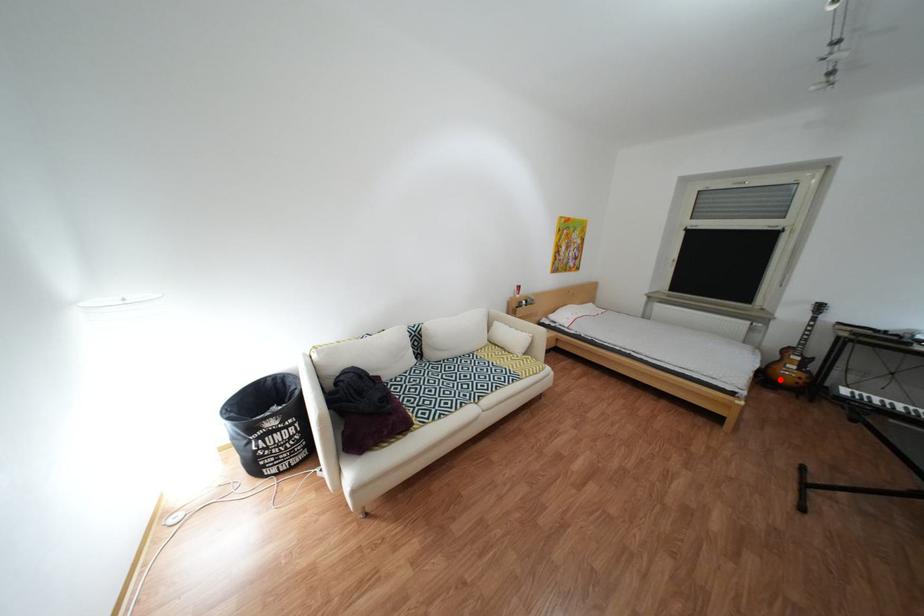
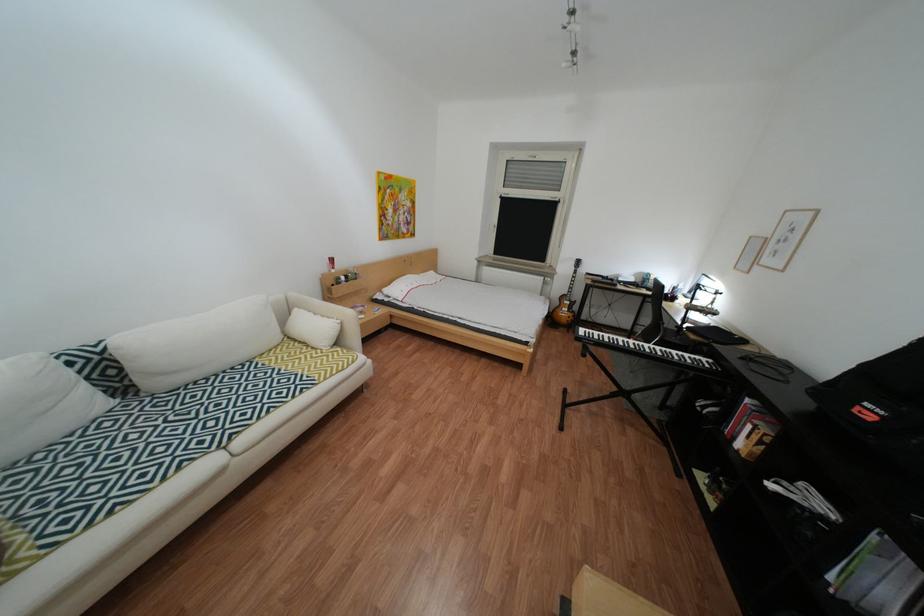
Question: I am providing you with two images of the same scene from different viewpoints. A red point is shown in image1. For the corresponding object point in image2, is it positioned nearer or farther from the camera?

Choices:
 (A) Nearer
 (B) Farther

Answer: (B)